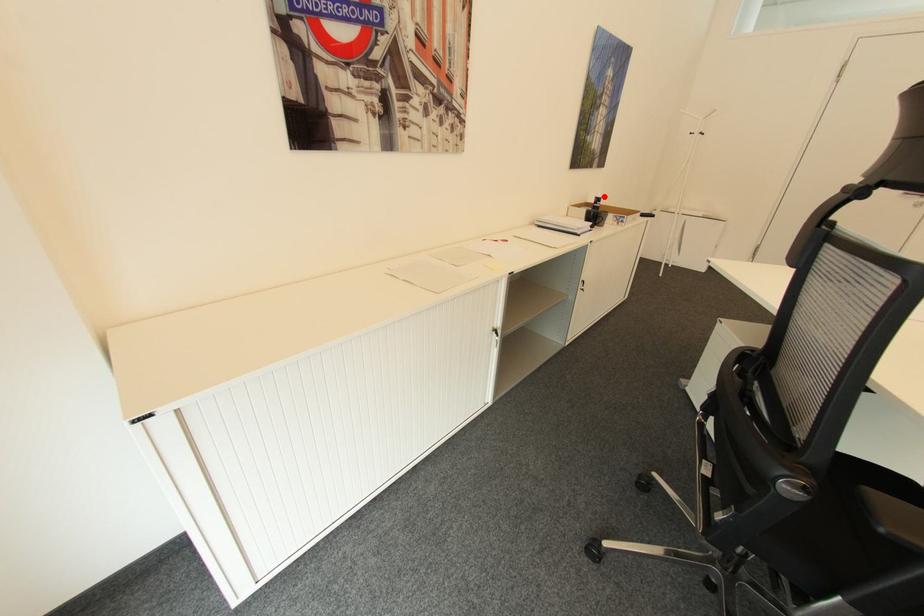
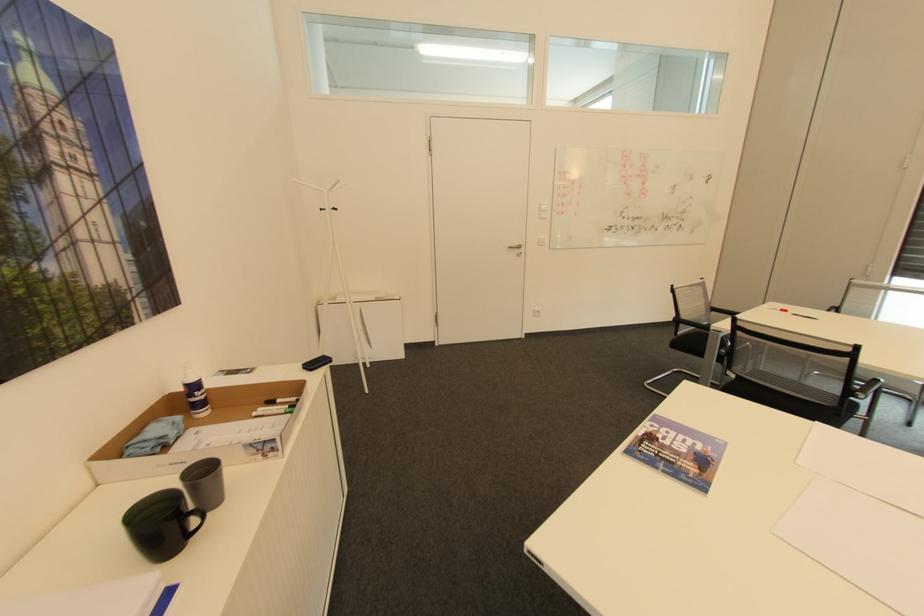
Question: I am providing you with two images of the same scene from different viewpoints. Given a red point in image1, look at the same physical point in image2. Is it:

Choices:
 (A) Closer to the viewpoint
 (B) Farther from the viewpoint

Answer: (A)